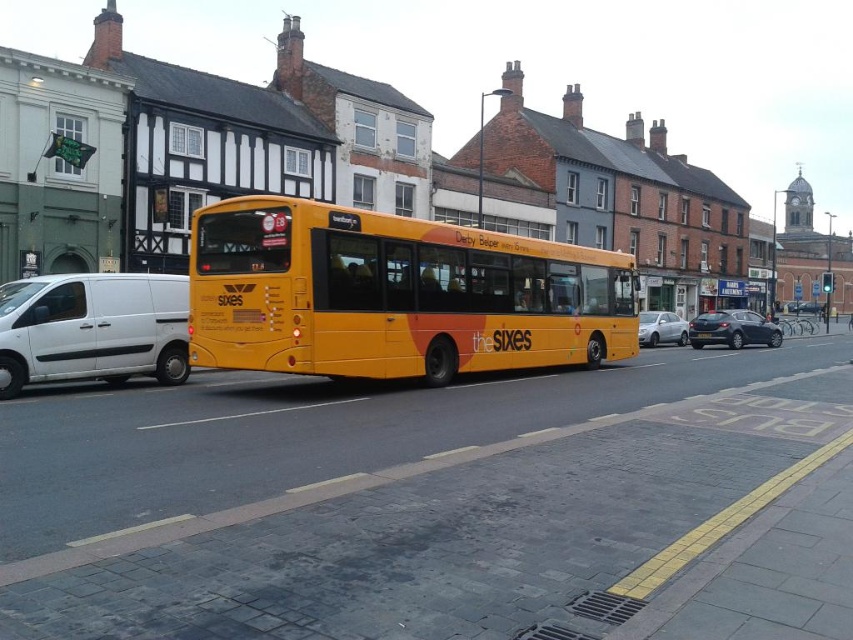
Who is higher up, yellow matte bus at center or yellow matte license plate at center?

Positioned higher is yellow matte bus at center.

Locate an element on the screen. This screenshot has height=640, width=853. yellow matte bus at center is located at coordinates (393, 294).

Which is more to the left, white matte van at left or dark gray metallic car at right?

From the viewer's perspective, white matte van at left appears more on the left side.

Which is behind, point (135, 273) or point (721, 323)?

Point (721, 323)

At what (x,y) coordinates should I click in order to perform the action: click on white matte van at left. Please return your answer as a coordinate pair (x, y). Looking at the image, I should click on (91, 328).

Is white matte van at left smaller than yellow matte license plate at center?

Actually, white matte van at left might be larger than yellow matte license plate at center.

From the picture: Can you confirm if white matte van at left is taller than yellow matte license plate at center?

Indeed, white matte van at left has a greater height compared to yellow matte license plate at center.

This screenshot has height=640, width=853. What are the coordinates of `white matte van at left` in the screenshot? It's located at (x=91, y=328).